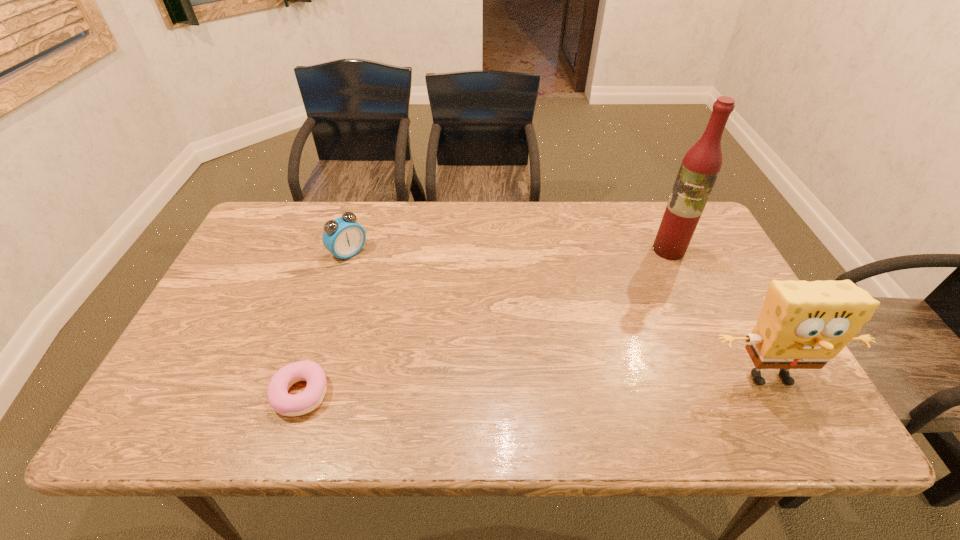
Identify the location of vacant space on the desktop that is between the pastry and the sponge and is positioned on the face of the alarm clock. (505, 386).

What are the coordinates of `free space on the desktop that is between the shortest object and the third shortest object and is positioned on the label of the liquor` in the screenshot? It's located at (546, 384).